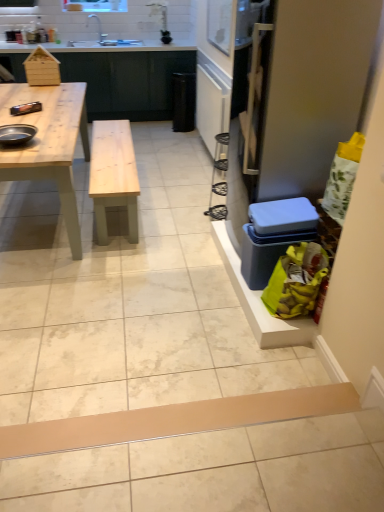
Question: Is shiny black pan at left facing towards brown cardboard plank at lower center?

Choices:
 (A) no
 (B) yes

Answer: (A)

Question: Is shiny black pan at left outside of brown cardboard plank at lower center?

Choices:
 (A) yes
 (B) no

Answer: (A)

Question: Is brown cardboard plank at lower center located within shiny black pan at left?

Choices:
 (A) no
 (B) yes

Answer: (A)

Question: Is shiny black pan at left taller than brown cardboard plank at lower center?

Choices:
 (A) no
 (B) yes

Answer: (A)

Question: Considering the relative sizes of shiny black pan at left and brown cardboard plank at lower center in the image provided, is shiny black pan at left thinner than brown cardboard plank at lower center?

Choices:
 (A) no
 (B) yes

Answer: (A)

Question: From the image's perspective, is white ceramic sink at upper center above or below clear plastic screen door at right?

Choices:
 (A) above
 (B) below

Answer: (A)

Question: Is white ceramic sink at upper center taller or shorter than clear plastic screen door at right?

Choices:
 (A) tall
 (B) short

Answer: (B)

Question: From a real-world perspective, relative to clear plastic screen door at right, is white ceramic sink at upper center vertically above or below?

Choices:
 (A) below
 (B) above

Answer: (B)

Question: Considering the positions of white ceramic sink at upper center and clear plastic screen door at right in the image, is white ceramic sink at upper center bigger or smaller than clear plastic screen door at right?

Choices:
 (A) small
 (B) big

Answer: (A)

Question: From the image's perspective, is white ceramic sink at upper center located above or below matte wood counter at upper left?

Choices:
 (A) above
 (B) below

Answer: (A)

Question: From a real-world perspective, is white ceramic sink at upper center above or below matte wood counter at upper left?

Choices:
 (A) below
 (B) above

Answer: (B)

Question: Is white ceramic sink at upper center taller or shorter than matte wood counter at upper left?

Choices:
 (A) tall
 (B) short

Answer: (B)

Question: Based on their positions, is white ceramic sink at upper center located to the left or right of matte wood counter at upper left?

Choices:
 (A) right
 (B) left

Answer: (A)

Question: From the image's perspective, is natural wood table at left located above or below brown cardboard plank at lower center?

Choices:
 (A) below
 (B) above

Answer: (B)

Question: Which is correct: natural wood table at left is inside brown cardboard plank at lower center, or outside of it?

Choices:
 (A) inside
 (B) outside

Answer: (B)